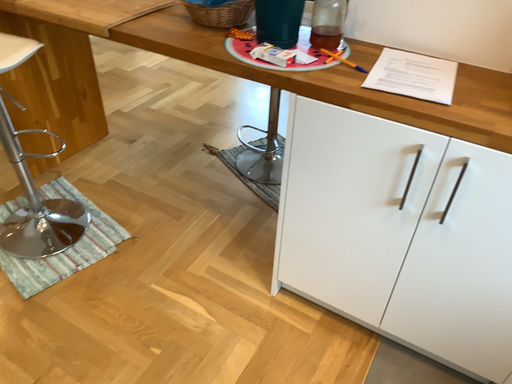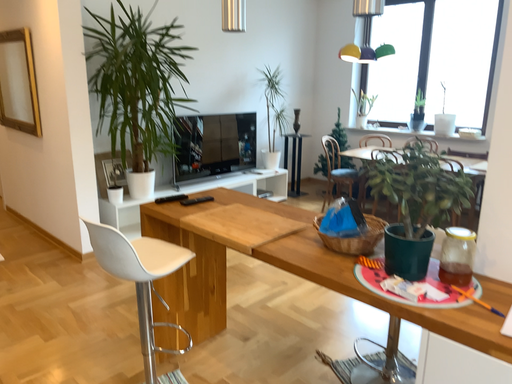
Question: How did the camera likely rotate when shooting the video?

Choices:
 (A) rotated upward
 (B) rotated downward

Answer: (A)